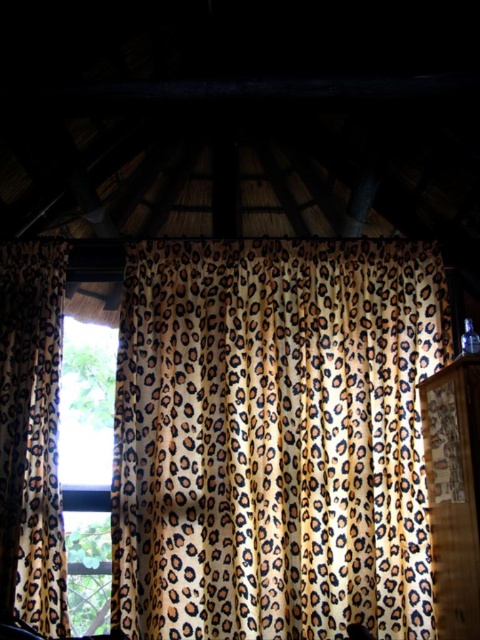
You are standing in a room with a leopard print fabric curtain at left. You want to reach the curtain to adjust it. Considering the distance between you and the curtain, can you comfortably walk to it without needing to move furniture?

The leopard print fabric curtain at left is 9.44 feet away from you, which is a comfortable distance to walk to without needing to move any furniture.

You are an interior designer planning to hang a new painting. You notice two leopard print fabrics in the room. Where is the leopard print fabric at center in relation to the leopard print fabric curtain at left?

The leopard print fabric at center is located above the leopard print fabric curtain at left.